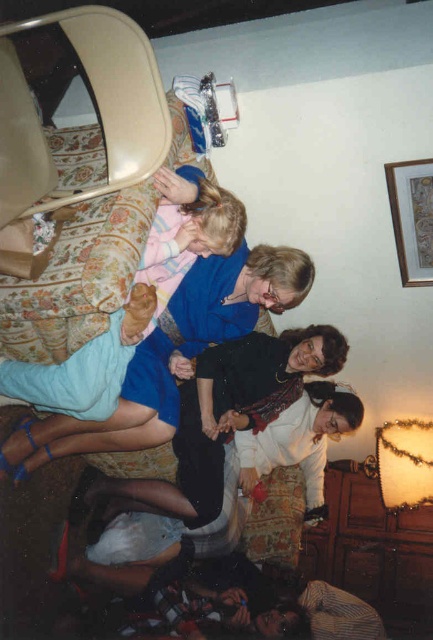
You are a photographer trying to capture a closeup shot of the blue fabric dress at center and the light blue denim pants at center. Since you want to focus on the dress, which object should you adjust your camera to prioritize in the frame?

The blue fabric dress at center is larger in size than the light blue denim pants at center, so you should adjust your camera to prioritize the blue fabric dress at center in the frame.

You are a photographer standing in the living room and want to take a photo of the blue fabric dress at center and the light blue denim pants at center. The camera you are using has a minimum focus distance of 10 inches. Will you be able to capture both subjects clearly in the photo?

The blue fabric dress at center and light blue denim pants at center are 9.68 inches apart from each other, which is less than the camera minimum focus distance of 10 inches. Therefore, you will not be able to capture both subjects clearly in the photo.